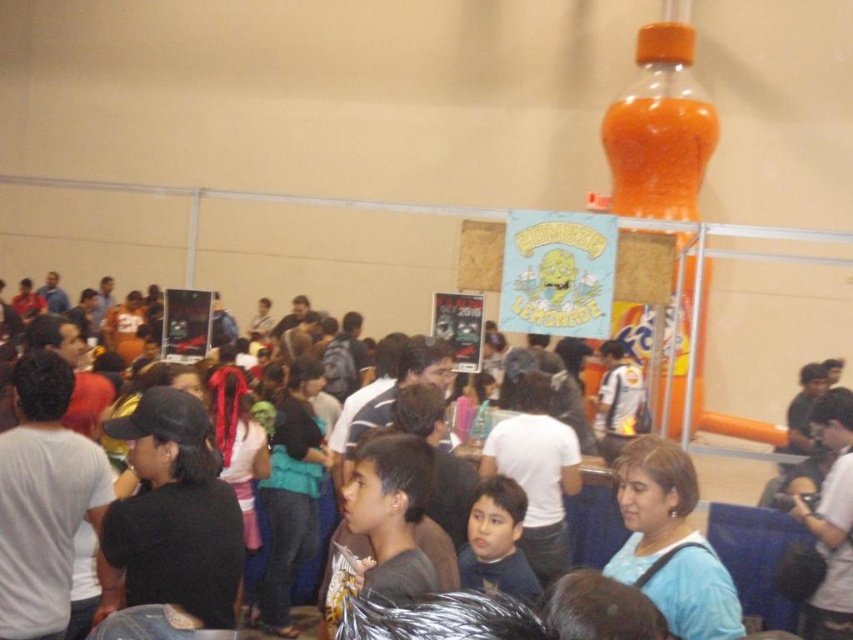
You are at an indoor event and see two people wearing a matte black shirt at center and a dark blue shirt at center. Which one is positioned to the right?

The matte black shirt at center is positioned to the right of the dark blue shirt at center.

You are at the event and want to see what the matte black shirt at center and dark blue shirt at center are looking at. Which one is blocking your view of the other?

The dark blue shirt at center is behind the matte black shirt at center, so the matte black shirt at center is blocking the view of the dark blue shirt at center.

You are standing in the middle of the crowd at the event and notice two points marked in the scene. The first point is at coordinates point (576, 563) and the second is at point (473, 564). Which point is closer to you?

Point (473, 564) is closer to you because it is closer to the camera than point (576, 563).